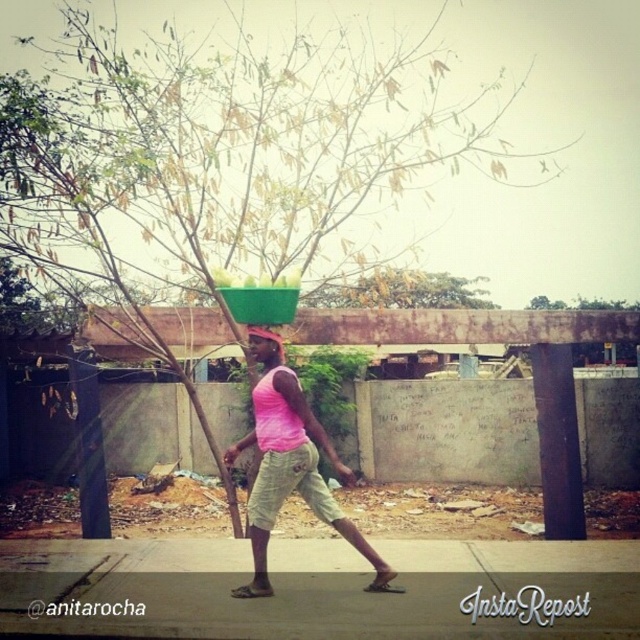
You are a photographer trying to capture the scene. You notice the gray concrete pavement at lower center and the pink fabric head at center. Which object would you focus on if you want to emphasize the scale of the environment?

The gray concrete pavement at lower center has a larger size compared to the pink fabric head at center, so focusing on the gray concrete pavement at lower center would better emphasize the scale of the environment.

You are standing at the edge of the scene looking towards the gray concrete pavement at lower center and the pink fabric tank top at center. Which object is nearer to you?

The gray concrete pavement at lower center is closer to the viewer than the pink fabric tank top at center.

You are a photographer trying to capture the scene. You notice the gray concrete pavement at lower center and the pink fabric tank top at center. Which object is located to the left of the other?

The gray concrete pavement at lower center is positioned on the left side of pink fabric tank top at center.